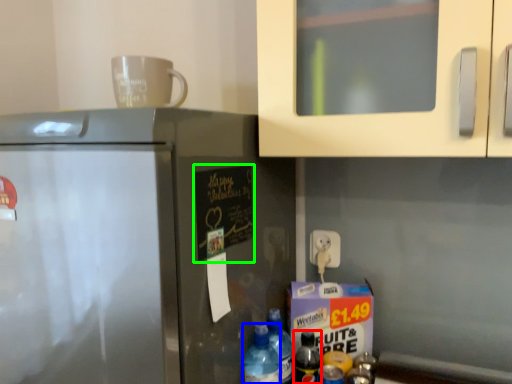
Question: Based on their relative distances, which object is nearer to bottle (highlighted by a red box)? Choose from bottle (highlighted by a blue box) and bulletin board (highlighted by a green box).

Choices:
 (A) bottle
 (B) bulletin board

Answer: (A)